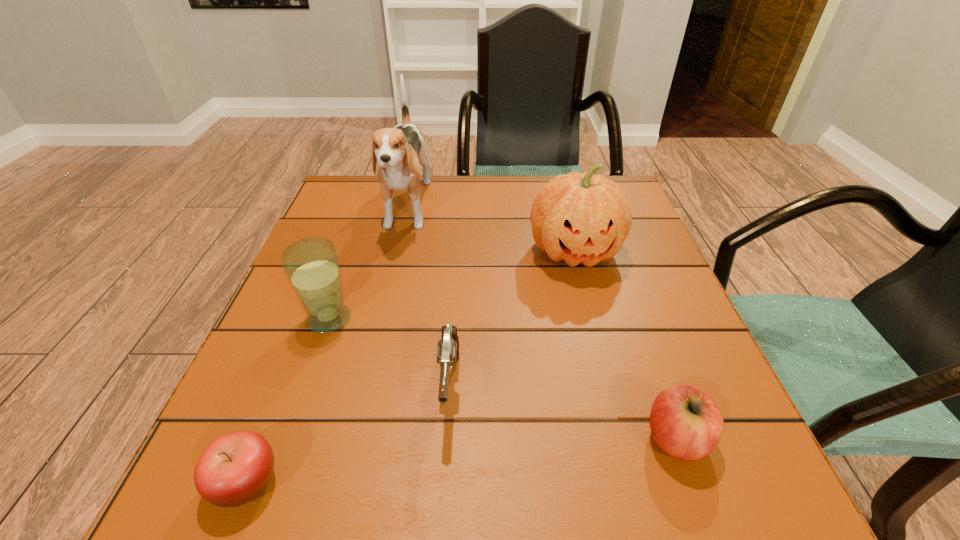
In order to click on free space at the near left corner of the desktop in this screenshot , I will do `click(309, 457)`.

Where is `vacant area at the near right corner`? vacant area at the near right corner is located at coordinates (679, 461).

Find the location of a particular element. Image resolution: width=960 pixels, height=540 pixels. empty space between the puppy and the left apple is located at coordinates (326, 346).

I want to click on empty location between the pistol and the right apple, so click(563, 413).

You are a GUI agent. You are given a task and a screenshot of the screen. Output one action in this format:
    pyautogui.click(x=<x>, y=<y>)
    Task: Click on the empty location between the fourth object from right to left and the fourth object from left to right
    
    Given the screenshot: What is the action you would take?
    pyautogui.click(x=428, y=299)

Find the location of a particular element. The width and height of the screenshot is (960, 540). free spot between the puppy and the fifth shortest object is located at coordinates (491, 231).

This screenshot has height=540, width=960. Find the location of `free spot between the left apple and the right apple`. free spot between the left apple and the right apple is located at coordinates (461, 461).

I want to click on free space between the second tallest object and the left apple, so click(410, 367).

Identify the location of empty space between the left apple and the tallest object. This screenshot has width=960, height=540. (326, 346).

At what (x,y) coordinates should I click in order to perform the action: click on free area in between the puppy and the fifth shortest object. Please return your answer as a coordinate pair (x, y). Looking at the image, I should click on [491, 231].